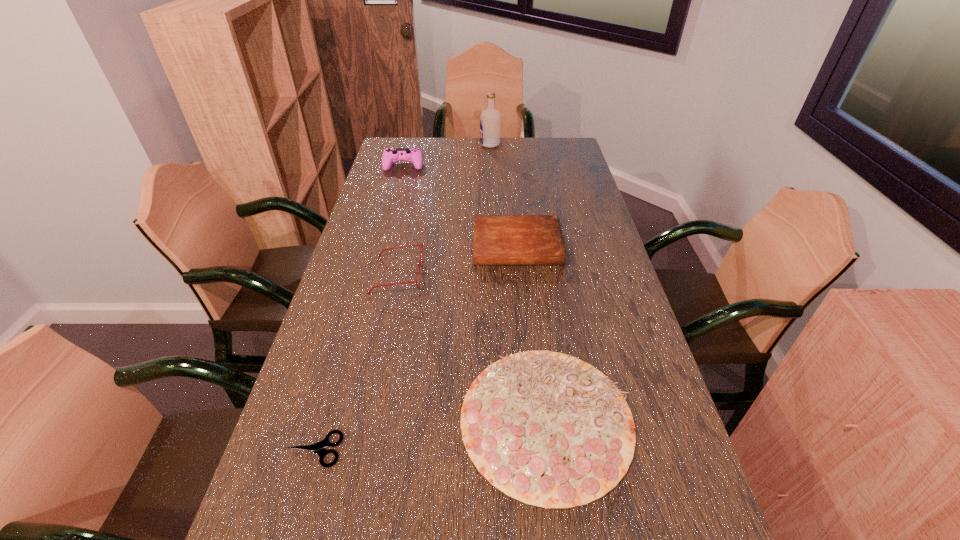
Find the location of a particular element. free space that satisfies the following two spatial constraints: 1. on the label of the farthest object; 2. on the right side of the pizza is located at coordinates (500, 418).

Where is `free region that satisfies the following two spatial constraints: 1. on the face of the pizza; 2. on the left side of the spectacles`? This screenshot has height=540, width=960. free region that satisfies the following two spatial constraints: 1. on the face of the pizza; 2. on the left side of the spectacles is located at coordinates (367, 418).

Where is `vacant space that satisfies the following two spatial constraints: 1. on the spine side of the Bible; 2. on the right side of the pizza`? The image size is (960, 540). vacant space that satisfies the following two spatial constraints: 1. on the spine side of the Bible; 2. on the right side of the pizza is located at coordinates (535, 418).